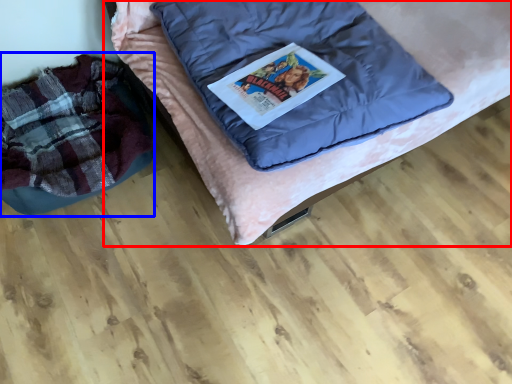
Question: Which point is closer to the camera, furniture (highlighted by a red box) or bean bag chair (highlighted by a blue box)?

Choices:
 (A) furniture
 (B) bean bag chair

Answer: (A)